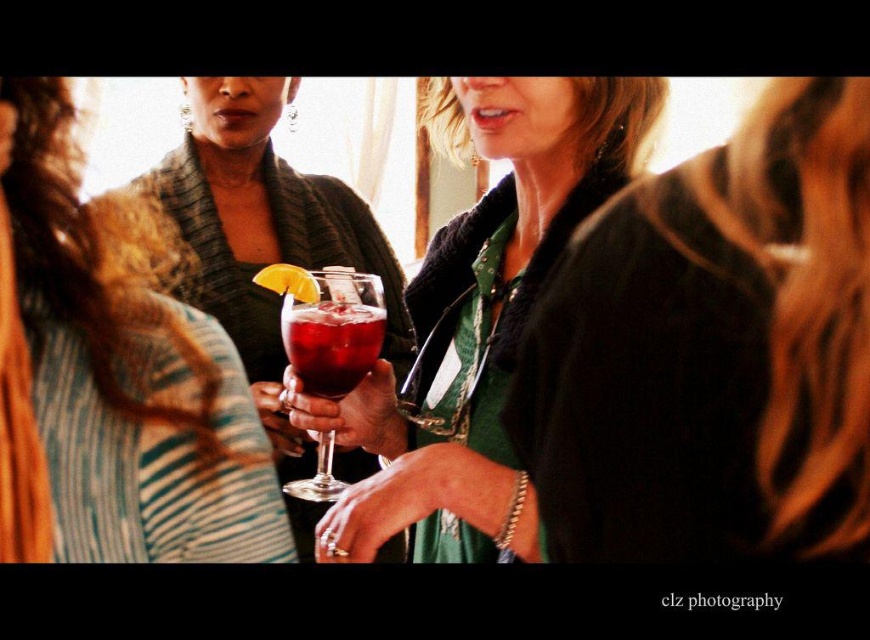
You are a photographer adjusting the camera settings to focus on the green fabric dress at center and the matte glass at center. Which object should you focus on first if you want to capture both clearly in the same frame?

The green fabric dress at center is below matte glass at center, so you should focus on the matte glass at center first to ensure both are in focus since it is closer to the camera.

You are a bartender preparing drinks for a party. You have two glasses in front of you, a matte glass wine at center and a matte glass at center. Which glass should you choose if you need to serve a drink that requires a taller glass?

The matte glass at center is taller than the matte glass wine at center, so you should choose the matte glass at center for the drink that requires a taller glass.

You are a photographer setting up for an event. You need to ensure that the matte black dress at center and the matte glass wine at center are both visible in your shot. Given their sizes, which object will require more space in the frame to capture fully?

The matte glass wine at center requires more space in the frame because its width is greater than the matte black dress at center.